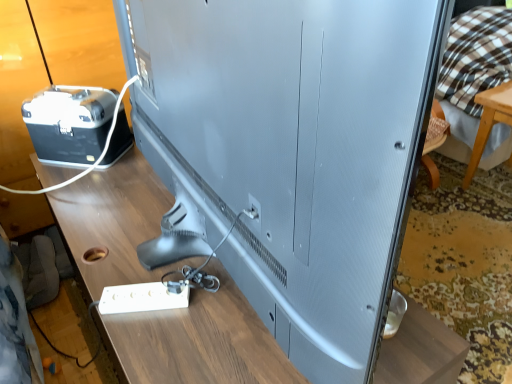
Question: Does wooden table at center have a larger size compared to brown checkered fabric at upper right?

Choices:
 (A) yes
 (B) no

Answer: (B)

Question: From a real-world perspective, is wooden table at center on top of brown checkered fabric at upper right?

Choices:
 (A) yes
 (B) no

Answer: (B)

Question: From the image's perspective, is wooden table at center above brown checkered fabric at upper right?

Choices:
 (A) no
 (B) yes

Answer: (A)

Question: Is the surface of wooden table at center in direct contact with brown checkered fabric at upper right?

Choices:
 (A) yes
 (B) no

Answer: (B)

Question: Can you confirm if wooden table at center is positioned to the right of brown checkered fabric at upper right?

Choices:
 (A) no
 (B) yes

Answer: (A)

Question: From a real-world perspective, is wooden table at center beneath brown checkered fabric at upper right?

Choices:
 (A) no
 (B) yes

Answer: (B)

Question: Considering the relative sizes of white plastic extension cord at lower left and brown checkered fabric at upper right in the image provided, is white plastic extension cord at lower left thinner than brown checkered fabric at upper right?

Choices:
 (A) no
 (B) yes

Answer: (B)

Question: Considering the relative sizes of white plastic extension cord at lower left and brown checkered fabric at upper right in the image provided, is white plastic extension cord at lower left wider than brown checkered fabric at upper right?

Choices:
 (A) no
 (B) yes

Answer: (A)

Question: From a real-world perspective, is white plastic extension cord at lower left below brown checkered fabric at upper right?

Choices:
 (A) no
 (B) yes

Answer: (A)

Question: From the image's perspective, is white plastic extension cord at lower left over brown checkered fabric at upper right?

Choices:
 (A) no
 (B) yes

Answer: (A)

Question: Considering the relative sizes of white plastic extension cord at lower left and brown checkered fabric at upper right in the image provided, is white plastic extension cord at lower left bigger than brown checkered fabric at upper right?

Choices:
 (A) yes
 (B) no

Answer: (B)

Question: Can you confirm if white plastic extension cord at lower left is smaller than brown checkered fabric at upper right?

Choices:
 (A) yes
 (B) no

Answer: (A)

Question: From the image's perspective, is brown checkered fabric at upper right beneath white plastic wire at left?

Choices:
 (A) no
 (B) yes

Answer: (A)